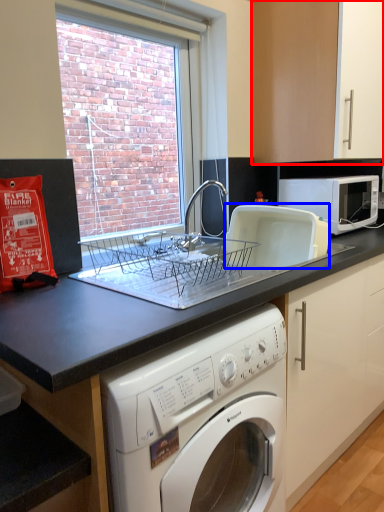
Question: Which object appears closest to the camera in this image, cabinetry (highlighted by a red box) or appliance (highlighted by a blue box)?

Choices:
 (A) cabinetry
 (B) appliance

Answer: (B)